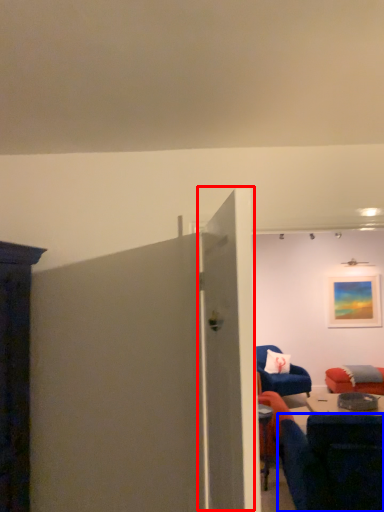
Question: Among these objects, which one is farthest to the camera, door (highlighted by a red box) or chair (highlighted by a blue box)?

Choices:
 (A) door
 (B) chair

Answer: (B)